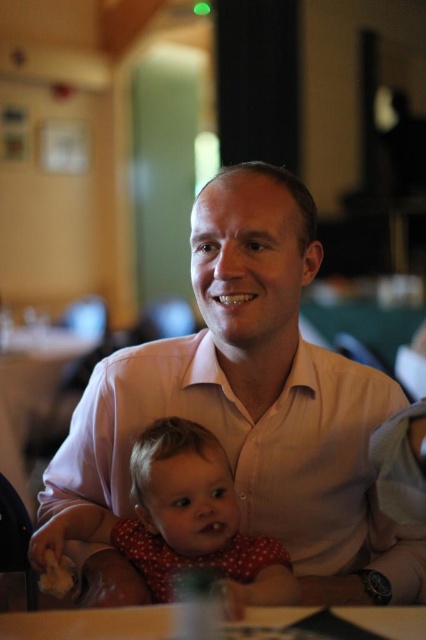
Who is positioned more to the right, polka dot fabric baby at center or white glossy table at lower center?

white glossy table at lower center

Who is shorter, polka dot fabric baby at center or white glossy table at lower center?

white glossy table at lower center is shorter.

This screenshot has width=426, height=640. What do you see at coordinates (180, 522) in the screenshot? I see `polka dot fabric baby at center` at bounding box center [180, 522].

Locate an element on the screen. Image resolution: width=426 pixels, height=640 pixels. polka dot fabric baby at center is located at coordinates (180, 522).

Is pink smooth shirt at center wider than polka dot fabric baby at center?

Correct, the width of pink smooth shirt at center exceeds that of polka dot fabric baby at center.

Can you confirm if pink smooth shirt at center is positioned below polka dot fabric baby at center?

No, pink smooth shirt at center is not below polka dot fabric baby at center.

Which is in front, point (304, 221) or point (206, 493)?

Point (206, 493) is in front.

This screenshot has width=426, height=640. What are the coordinates of `pink smooth shirt at center` in the screenshot? It's located at (256, 401).

Does pink smooth shirt at center lie in front of white glossy table at lower center?

No.

Which of these two, pink smooth shirt at center or white glossy table at lower center, stands taller?

Standing taller between the two is pink smooth shirt at center.

Locate an element on the screen. This screenshot has height=640, width=426. pink smooth shirt at center is located at coordinates (256, 401).